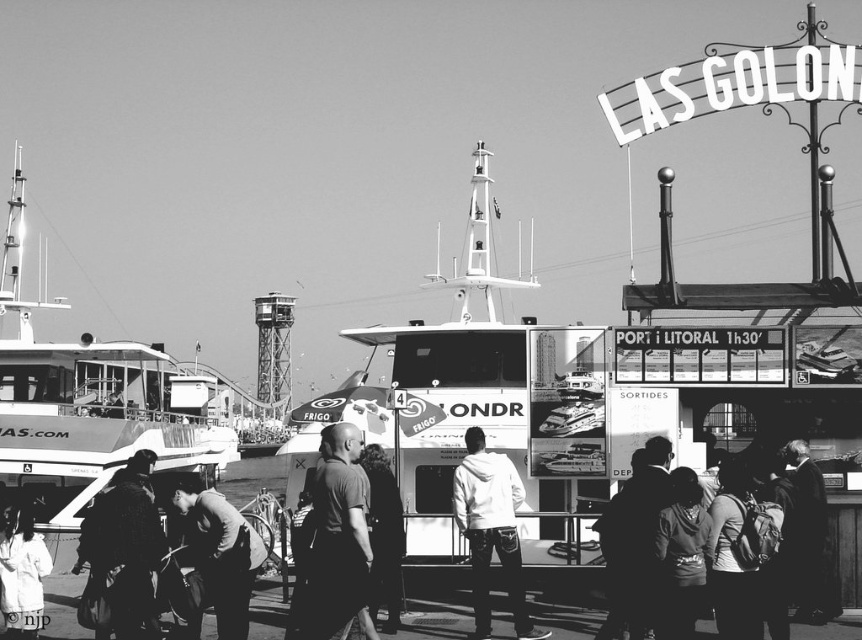
Question: Is dark gray shirt at center wider than matte black backpack at lower right?

Choices:
 (A) no
 (B) yes

Answer: (B)

Question: Which point is farther to the camera?

Choices:
 (A) (681, 580)
 (B) (473, 445)

Answer: (B)

Question: Can you confirm if white matte hoodie at center is positioned below dark gray suit at lower right?

Choices:
 (A) no
 (B) yes

Answer: (B)

Question: Which object is closer to the camera taking this photo?

Choices:
 (A) dark gray fabric jacket at lower left
 (B) matte black backpack at lower right
 (C) dark clothing at center
 (D) dark textured backpack at lower left

Answer: (C)

Question: Based on their relative distances, which object is farther from the dark gray suit at lower right?

Choices:
 (A) white cotton shirt at lower left
 (B) white matte boat at center
 (C) dark gray sweater at lower center

Answer: (A)

Question: Does dark gray shirt at center have a lesser width compared to dark gray sweater at lower center?

Choices:
 (A) yes
 (B) no

Answer: (B)